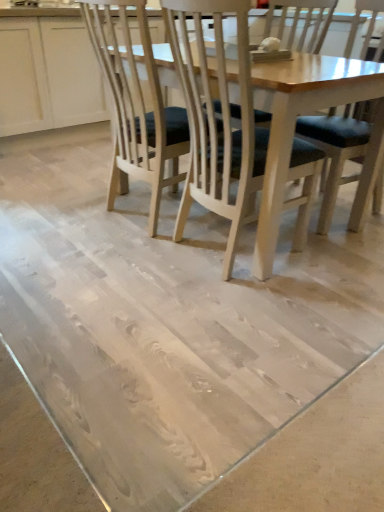
Question: Is the position of dark blue fabric chair at center, which is the 1th chair in right-to-left order, less distant than that of white wood cabinet at upper left?

Choices:
 (A) yes
 (B) no

Answer: (A)

Question: Considering the relative sizes of dark blue fabric chair at center, placed as the second chair when sorted from left to right, and white wood cabinet at upper left in the image provided, is dark blue fabric chair at center, placed as the second chair when sorted from left to right, bigger than white wood cabinet at upper left?

Choices:
 (A) yes
 (B) no

Answer: (B)

Question: From a real-world perspective, is dark blue fabric chair at center, placed as the second chair when sorted from left to right, beneath white wood cabinet at upper left?

Choices:
 (A) yes
 (B) no

Answer: (B)

Question: Is dark blue fabric chair at center, placed as the second chair when sorted from left to right, completely or partially outside of white wood cabinet at upper left?

Choices:
 (A) yes
 (B) no

Answer: (A)

Question: From a real-world perspective, is dark blue fabric chair at center, which is the 1th chair in right-to-left order, physically above white wood cabinet at upper left?

Choices:
 (A) no
 (B) yes

Answer: (B)

Question: Is wooden chair with dark cushion at center, the 2th chair when ordered from right to left, in front of or behind dark blue fabric chair at center, placed as the second chair when sorted from left to right, in the image?

Choices:
 (A) front
 (B) behind

Answer: (B)

Question: From the image's perspective, relative to dark blue fabric chair at center, placed as the second chair when sorted from left to right, is wooden chair with dark cushion at center, which appears as the first chair when viewed from the left, above or below?

Choices:
 (A) above
 (B) below

Answer: (A)

Question: Is wooden chair with dark cushion at center, the 2th chair when ordered from right to left, situated inside dark blue fabric chair at center, which is the 1th chair in right-to-left order, or outside?

Choices:
 (A) outside
 (B) inside

Answer: (A)

Question: From a real-world perspective, is wooden chair with dark cushion at center, the 2th chair when ordered from right to left, above or below dark blue fabric chair at center, which is the 1th chair in right-to-left order?

Choices:
 (A) below
 (B) above

Answer: (A)

Question: Looking at their shapes, would you say dark blue fabric chair at center, which is the 1th chair in right-to-left order, is wider or thinner than wooden chair with dark cushion at center, the 2th chair when ordered from right to left?

Choices:
 (A) thin
 (B) wide

Answer: (B)

Question: In the image, is dark blue fabric chair at center, placed as the second chair when sorted from left to right, on the left side or the right side of wooden chair with dark cushion at center, the 2th chair when ordered from right to left?

Choices:
 (A) left
 (B) right

Answer: (B)

Question: Relative to wooden chair with dark cushion at center, which appears as the first chair when viewed from the left, is dark blue fabric chair at center, which is the 1th chair in right-to-left order, in front or behind?

Choices:
 (A) behind
 (B) front

Answer: (B)

Question: Choose the correct answer: Is dark blue fabric chair at center, placed as the second chair when sorted from left to right, inside wooden chair with dark cushion at center, the 2th chair when ordered from right to left, or outside it?

Choices:
 (A) outside
 (B) inside

Answer: (A)

Question: From the image's perspective, is wooden chair with dark cushion at center, the 2th chair when ordered from right to left, above or below white wood cabinet at upper left?

Choices:
 (A) above
 (B) below

Answer: (B)

Question: From their relative heights in the image, would you say wooden chair with dark cushion at center, the 2th chair when ordered from right to left, is taller or shorter than white wood cabinet at upper left?

Choices:
 (A) tall
 (B) short

Answer: (A)